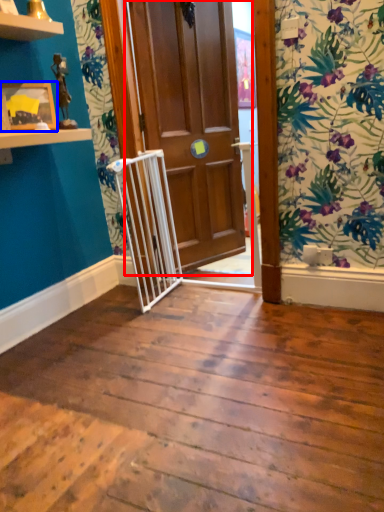
Question: Which point is further to the camera, door (highlighted by a red box) or picture frame (highlighted by a blue box)?

Choices:
 (A) door
 (B) picture frame

Answer: (A)